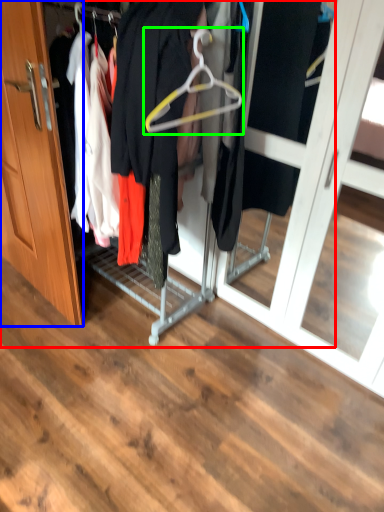
Question: Which object is the closest to the closet (highlighted by a red box)? Choose among these: door (highlighted by a blue box) or hanger (highlighted by a green box).

Choices:
 (A) door
 (B) hanger

Answer: (A)